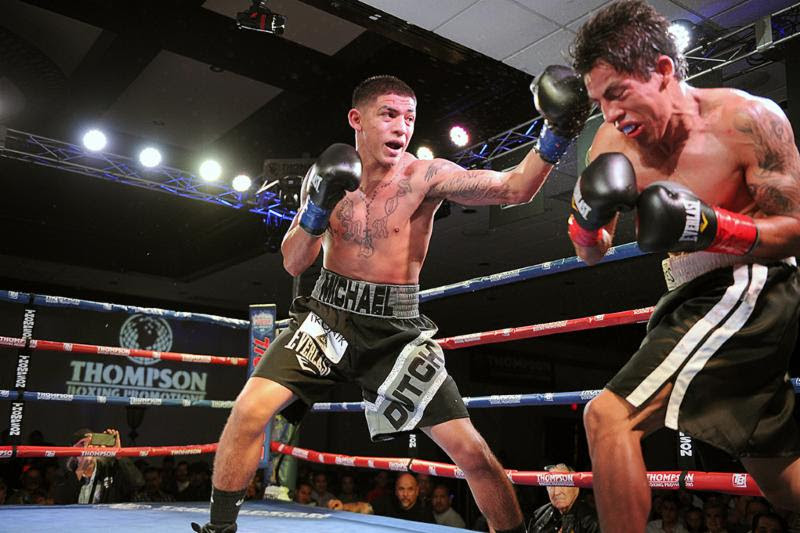
What are the coordinates of `boxing blue floor mat` in the screenshot? It's located at (98, 519).